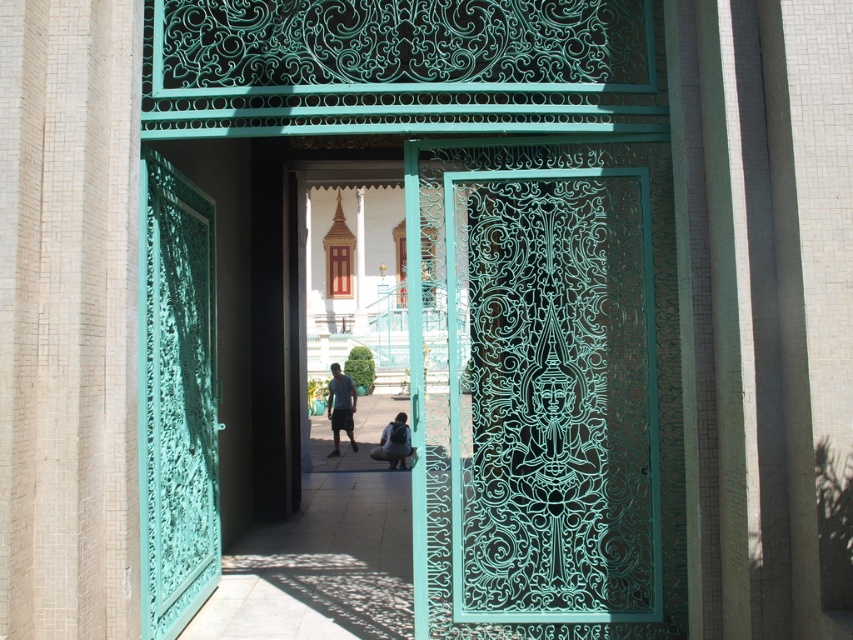
You are standing at the entrance of the temple and want to reach the matte black backpack at center. The green carved door at center is in your way. Can you walk through the door to get to the backpack?

The green carved door at center is 8.81 meters away from matte black backpack at center. Since the door is open, you can walk through it to reach the backpack.

Looking at this image, you are standing at the entrance of the temple and want to take a photo of the green carved wood door at left. If your camera has a maximum focus range of 5 meters, will it be able to capture the door clearly?

The green carved wood door at left is 4.56 meters away from the camera, which is within the maximum focus range of 5 meters. Therefore, the camera should be able to capture the door clearly.

You are standing at the entrance of the temple and want to place your matte black backpack at center without blocking the green carved door at center. Is this possible?

The green carved door at center is in front of the matte black backpack at center, meaning the backpack is already positioned behind the door. To place it without blocking the door, you can move the backpack further back or to the side so it remains behind the door but does not obstruct its view.